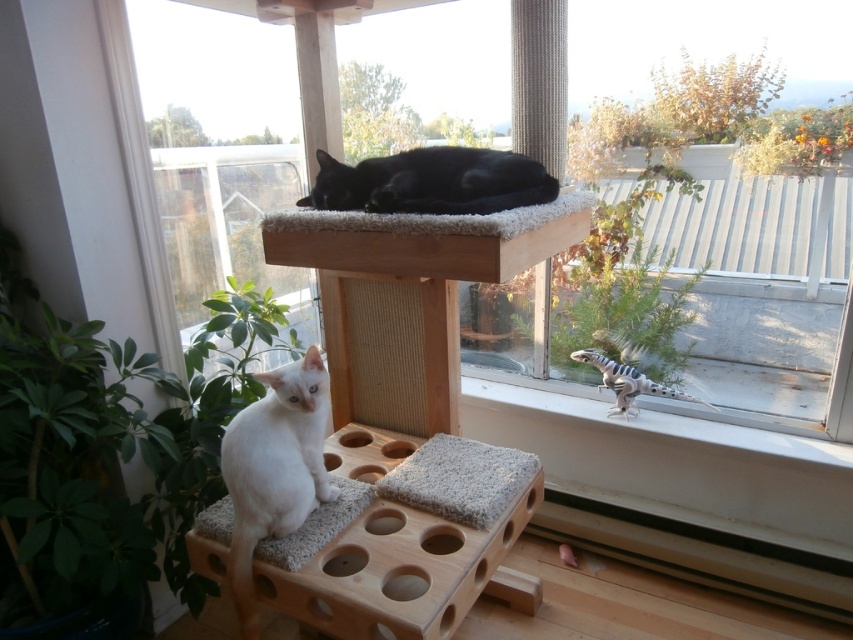
Between white fluffy cat at lower left and black fur cat at upper center, which one has less height?

black fur cat at upper center

Can you confirm if white fluffy cat at lower left is taller than black fur cat at upper center?

Yes.

Between point (241, 547) and point (312, 198), which one is positioned in front?

Point (241, 547)

You are a GUI agent. You are given a task and a screenshot of the screen. Output one action in this format:
    pyautogui.click(x=<x>, y=<y>)
    Task: Click on the white fluffy cat at lower left
    
    Given the screenshot: What is the action you would take?
    pyautogui.click(x=276, y=464)